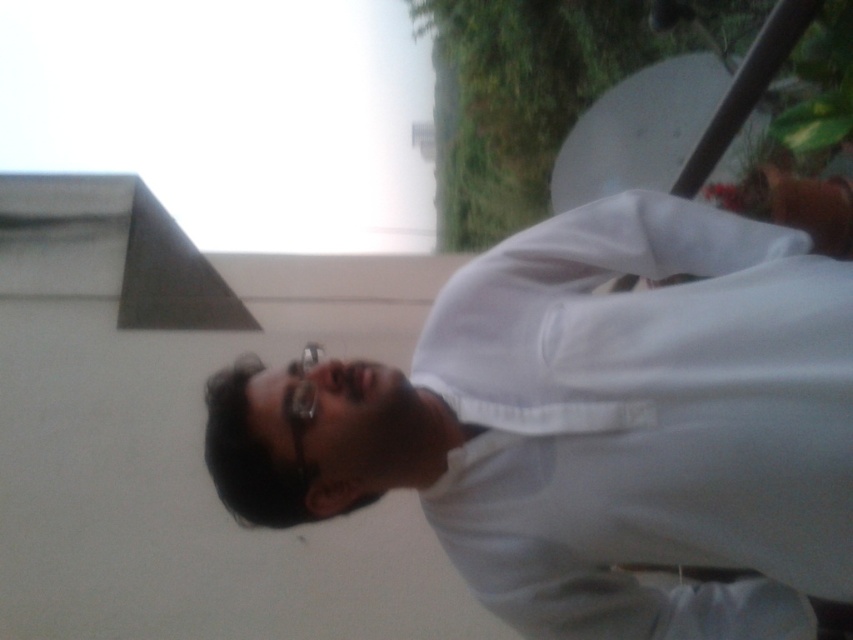
Question: Observing the image, what is the correct spatial positioning of white matte shirt at center in reference to semi-transparent plastic glasses at center?

Choices:
 (A) left
 (B) right

Answer: (B)

Question: Which point is closer to the camera?

Choices:
 (A) (494, 358)
 (B) (289, 364)

Answer: (B)

Question: Does white matte shirt at center have a greater width compared to semi-transparent plastic glasses at center?

Choices:
 (A) no
 (B) yes

Answer: (B)

Question: Which point is closer to the camera?

Choices:
 (A) (625, 371)
 (B) (311, 352)

Answer: (A)

Question: Is white matte shirt at center to the right of semi-transparent plastic glasses at center from the viewer's perspective?

Choices:
 (A) no
 (B) yes

Answer: (B)